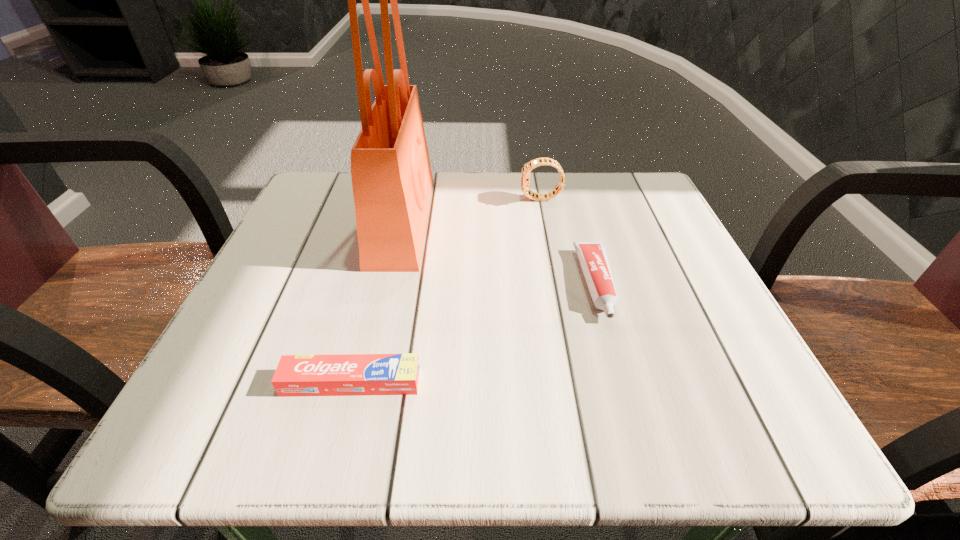
What are the coordinates of `free space at the right edge of the desktop` in the screenshot? It's located at (639, 238).

Where is `free spot at the near left corner of the desktop`? free spot at the near left corner of the desktop is located at coordinates (286, 410).

This screenshot has height=540, width=960. In the image, there is a desktop. In order to click on blank space at the far right corner in this screenshot , I will do `click(642, 180)`.

At what (x,y) coordinates should I click in order to perform the action: click on free space at the near right corner of the desktop. Please return your answer as a coordinate pair (x, y). Image resolution: width=960 pixels, height=540 pixels. Looking at the image, I should click on (742, 423).

Identify the location of vacant space that's between the watch and the nearest object. The height and width of the screenshot is (540, 960). (446, 291).

You are a GUI agent. You are given a task and a screenshot of the screen. Output one action in this format:
    pyautogui.click(x=<x>, y=<y>)
    Task: Click on the vacant region between the nearer toothpaste and the second tallest object
    The image size is (960, 540).
    Given the screenshot: What is the action you would take?
    click(446, 291)

Where is `free spot between the tallest object and the farther toothpaste`? This screenshot has height=540, width=960. free spot between the tallest object and the farther toothpaste is located at coordinates (499, 252).

The width and height of the screenshot is (960, 540). I want to click on empty space between the farther toothpaste and the tallest object, so click(x=499, y=252).

Locate an element on the screen. Image resolution: width=960 pixels, height=540 pixels. empty space that is in between the watch and the right toothpaste is located at coordinates 569,241.

You are a GUI agent. You are given a task and a screenshot of the screen. Output one action in this format:
    pyautogui.click(x=<x>, y=<y>)
    Task: Click on the free spot between the third shortest object and the nearer toothpaste
    
    Given the screenshot: What is the action you would take?
    pyautogui.click(x=446, y=291)